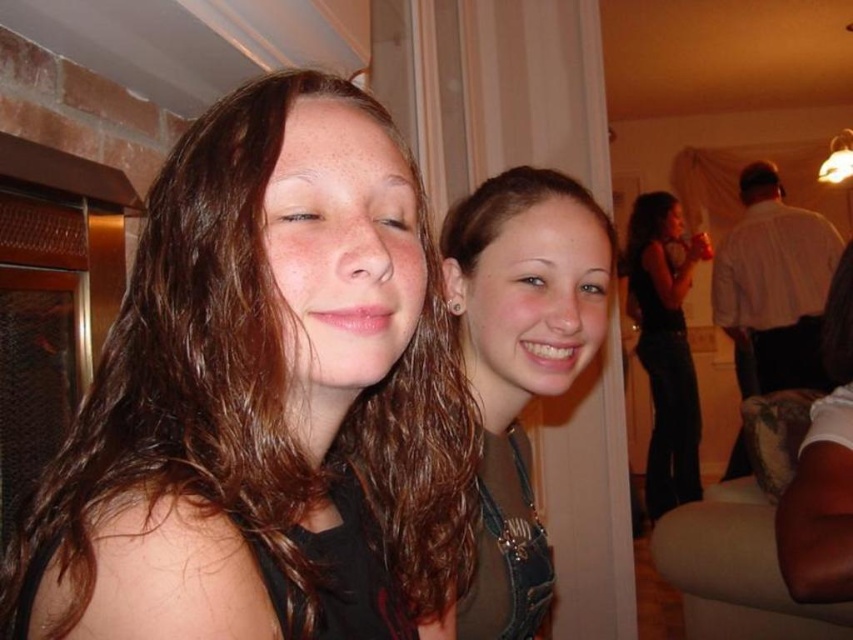
From the picture: Is white shirt at upper right thinner than black denim jeans at right?

No, white shirt at upper right is not thinner than black denim jeans at right.

Who is positioned more to the left, white shirt at upper right or black denim jeans at right?

black denim jeans at right is more to the left.

Between point (714, 268) and point (695, 406), which one is positioned in front?

Point (695, 406) is in front.

Identify the location of white shirt at upper right. The image size is (853, 640). (775, 285).

Between brown denim overalls at center and white shirt at upper right, which one has less height?

Standing shorter between the two is brown denim overalls at center.

What do you see at coordinates (521, 364) in the screenshot? I see `brown denim overalls at center` at bounding box center [521, 364].

Where is `brown denim overalls at center`? This screenshot has width=853, height=640. brown denim overalls at center is located at coordinates (521, 364).

Find the location of a particular element. This screenshot has height=640, width=853. brown denim overalls at center is located at coordinates (521, 364).

Is point (686, 288) less distant than point (471, 224)?

No, (686, 288) is further to viewer.

Looking at this image, is black denim jeans at right shorter than brown shiny hair at upper right?

No.

Is point (653, 493) positioned behind point (564, 176)?

Yes, point (653, 493) is behind point (564, 176).

Identify the location of black denim jeans at right. (664, 344).